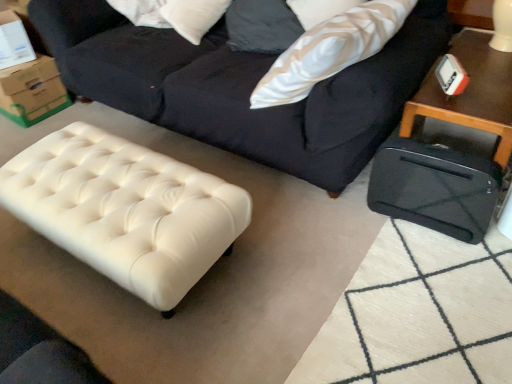
The image size is (512, 384). What are the coordinates of `free point above white leather ottoman at lower left, arranged as the second table when viewed from the right (from a real-world perspective)` in the screenshot? It's located at (110, 180).